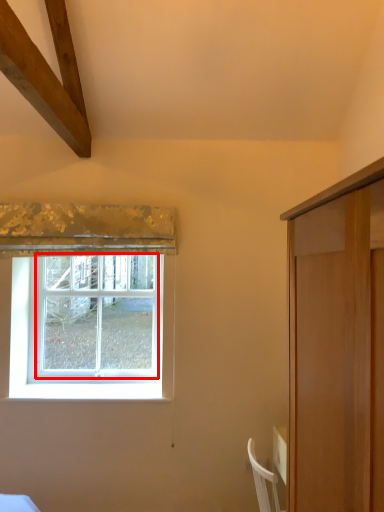
Question: Where is window (annotated by the red box) located in relation to curtain in the image?

Choices:
 (A) right
 (B) left

Answer: (B)